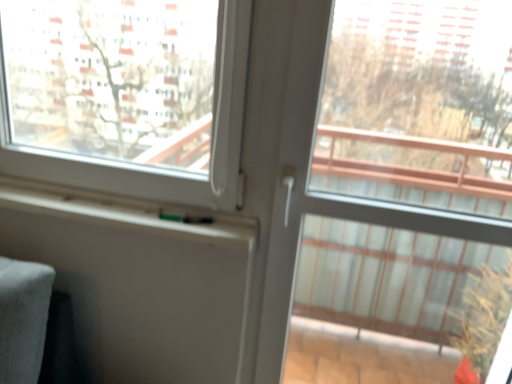
This screenshot has width=512, height=384. What do you see at coordinates (419, 105) in the screenshot?
I see `clear glass screen door at upper right` at bounding box center [419, 105].

Where is `clear glass screen door at upper right`? The height and width of the screenshot is (384, 512). clear glass screen door at upper right is located at coordinates (419, 105).

At what (x,y) coordinates should I click in order to perform the action: click on clear glass screen door at upper right. Please return your answer as a coordinate pair (x, y). The width and height of the screenshot is (512, 384). Looking at the image, I should click on (419, 105).